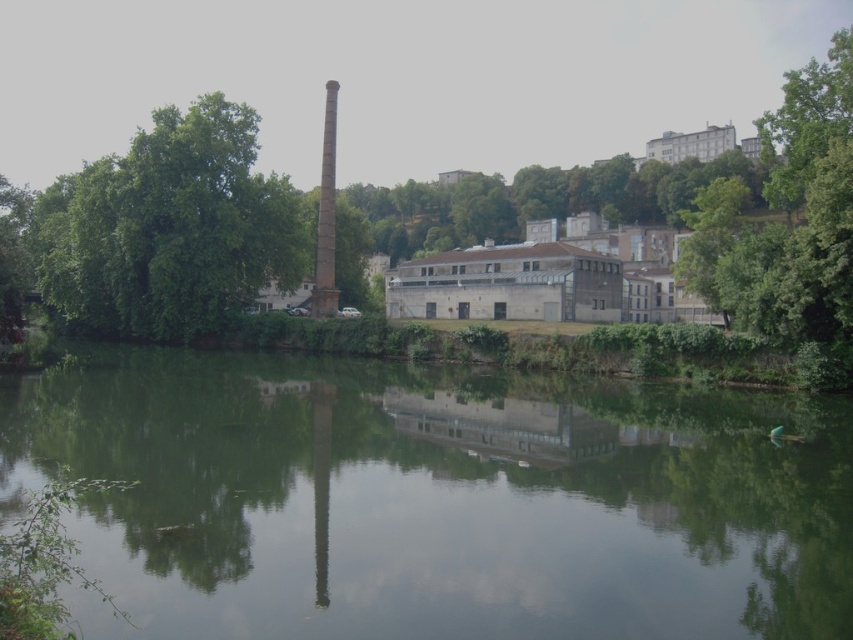
Can you confirm if green leafy tree at left is smaller than green leafy tree at upper right?

Correct, green leafy tree at left occupies less space than green leafy tree at upper right.

Who is positioned more to the right, green leafy tree at left or green leafy tree at upper right?

From the viewer's perspective, green leafy tree at upper right appears more on the right side.

The width and height of the screenshot is (853, 640). What do you see at coordinates (170, 228) in the screenshot? I see `green leafy tree at left` at bounding box center [170, 228].

At what (x,y) coordinates should I click in order to perform the action: click on green leafy tree at left. Please return your answer as a coordinate pair (x, y). This screenshot has height=640, width=853. Looking at the image, I should click on pyautogui.click(x=170, y=228).

Does green reflective water at center have a smaller size compared to green leafy tree at left?

Correct, green reflective water at center occupies less space than green leafy tree at left.

The width and height of the screenshot is (853, 640). What are the coordinates of `green reflective water at center` in the screenshot? It's located at (434, 499).

You are a GUI agent. You are given a task and a screenshot of the screen. Output one action in this format:
    pyautogui.click(x=<x>, y=<y>)
    Task: Click on the green reflective water at center
    The height and width of the screenshot is (640, 853).
    Given the screenshot: What is the action you would take?
    pyautogui.click(x=434, y=499)

Does green leafy tree at left appear on the left side of smooth concrete chimney at center?

Yes, green leafy tree at left is to the left of smooth concrete chimney at center.

What do you see at coordinates (170, 228) in the screenshot? I see `green leafy tree at left` at bounding box center [170, 228].

You are a GUI agent. You are given a task and a screenshot of the screen. Output one action in this format:
    pyautogui.click(x=<x>, y=<y>)
    Task: Click on the green leafy tree at left
    The width and height of the screenshot is (853, 640).
    Given the screenshot: What is the action you would take?
    pyautogui.click(x=170, y=228)